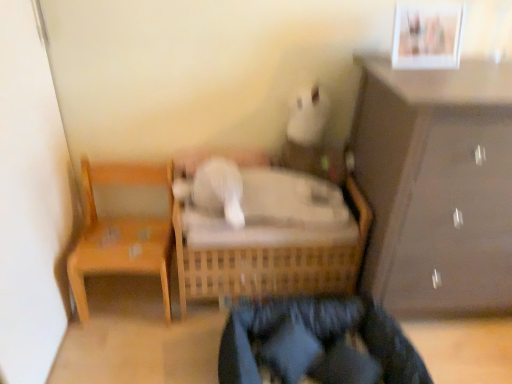
Question: Is white glossy picture frame at upper right shorter than woven wood crib at center?

Choices:
 (A) no
 (B) yes

Answer: (B)

Question: From a real-world perspective, is white glossy picture frame at upper right beneath woven wood crib at center?

Choices:
 (A) yes
 (B) no

Answer: (B)

Question: Does white glossy picture frame at upper right have a greater height compared to woven wood crib at center?

Choices:
 (A) no
 (B) yes

Answer: (A)

Question: Is white glossy picture frame at upper right looking in the opposite direction of woven wood crib at center?

Choices:
 (A) no
 (B) yes

Answer: (A)

Question: Is white glossy picture frame at upper right at the right side of woven wood crib at center?

Choices:
 (A) yes
 (B) no

Answer: (A)

Question: Is white glossy picture frame at upper right placed right next to woven wood crib at center?

Choices:
 (A) no
 (B) yes

Answer: (A)

Question: Does woven wood crib at center have a lesser width compared to wooden chair at left?

Choices:
 (A) yes
 (B) no

Answer: (B)

Question: From a real-world perspective, is woven wood crib at center over wooden chair at left?

Choices:
 (A) no
 (B) yes

Answer: (A)

Question: Does woven wood crib at center appear on the left side of wooden chair at left?

Choices:
 (A) yes
 (B) no

Answer: (B)

Question: Can you confirm if woven wood crib at center is shorter than wooden chair at left?

Choices:
 (A) no
 (B) yes

Answer: (B)

Question: Are woven wood crib at center and wooden chair at left making contact?

Choices:
 (A) yes
 (B) no

Answer: (B)

Question: Is woven wood crib at center bigger than wooden chair at left?

Choices:
 (A) no
 (B) yes

Answer: (B)

Question: Is white glossy picture frame at upper right closer to camera compared to matte brown cabinet at right?

Choices:
 (A) yes
 (B) no

Answer: (B)